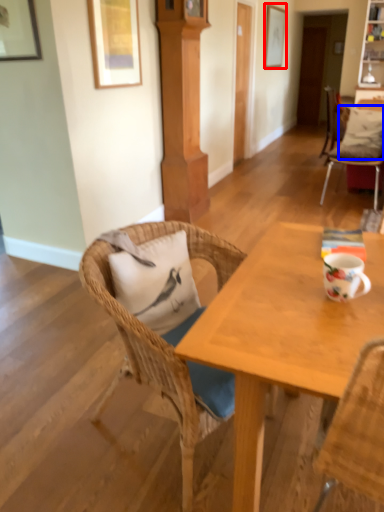
Question: Which object is closer to the camera taking this photo, picture frame (highlighted by a red box) or pillow (highlighted by a blue box)?

Choices:
 (A) picture frame
 (B) pillow

Answer: (B)